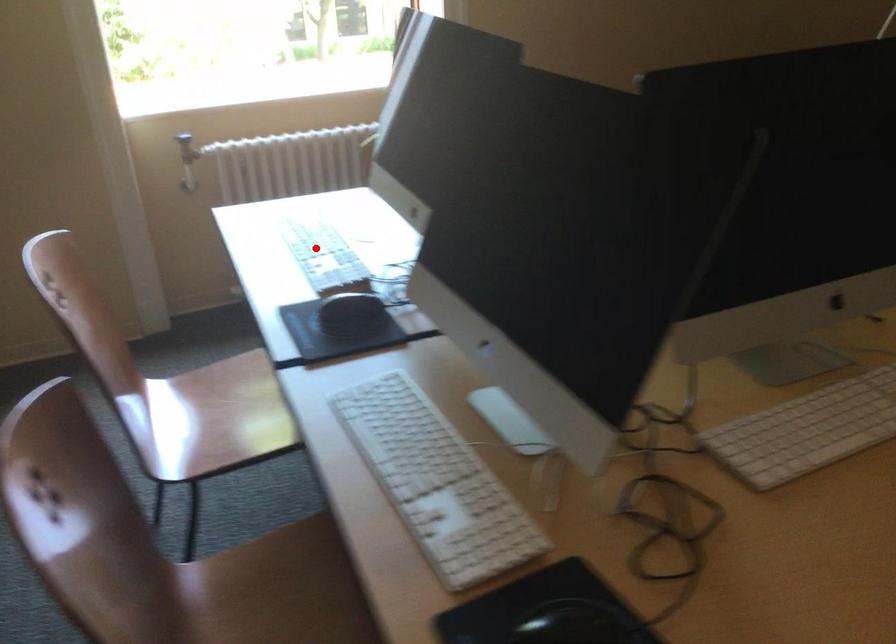
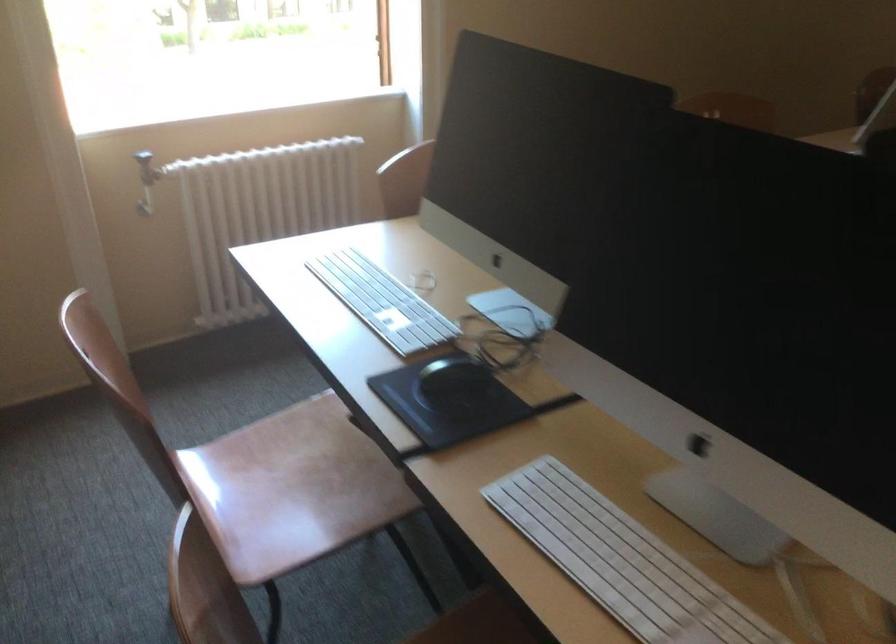
Locate, in the second image, the point that corresponds to the highlighted location in the first image.

(382, 301)